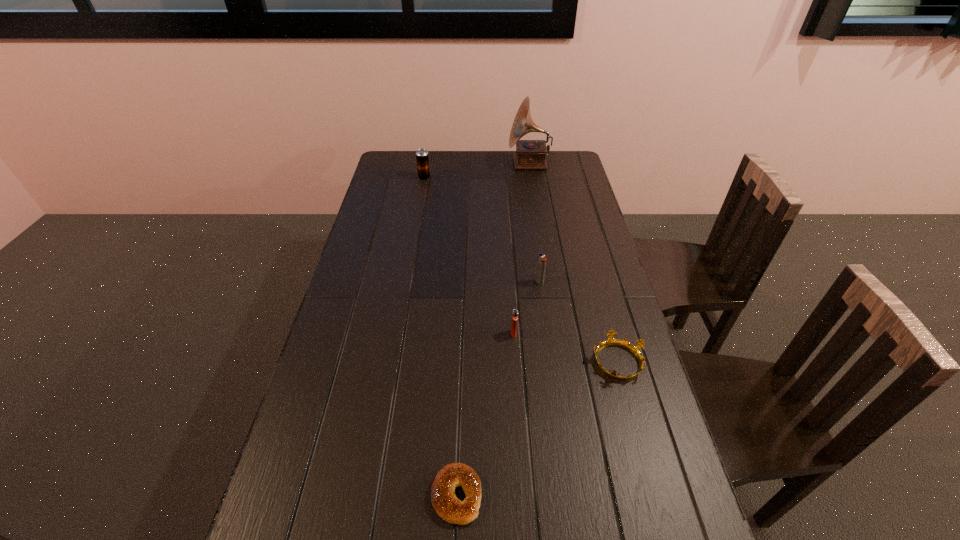
The width and height of the screenshot is (960, 540). What are the coordinates of `vacant point located 0.300m on the horn of the phonograph record` in the screenshot? It's located at (442, 164).

The width and height of the screenshot is (960, 540). I want to click on free spot located on the horn of the phonograph record, so click(x=446, y=164).

The image size is (960, 540). What are the coordinates of `free location located on the horn of the phonograph record` in the screenshot? It's located at (484, 164).

At what (x,y) coordinates should I click in order to perform the action: click on vacant area situated 0.350m on the right of the leftmost object. Please return your answer as a coordinate pair (x, y). The width and height of the screenshot is (960, 540). Looking at the image, I should click on (511, 178).

Find the location of `vacant space located 0.290m on the left of the taller igniter`. vacant space located 0.290m on the left of the taller igniter is located at coordinates (446, 282).

Find the location of a particular element. blank area located on the front of the third shortest object is located at coordinates (519, 414).

This screenshot has height=540, width=960. I want to click on vacant space located 0.360m on the left of the fifth farthest object, so [459, 361].

Locate an element on the screen. vacant space located 0.090m on the back of the shortest object is located at coordinates (459, 429).

Locate an element on the screen. This screenshot has width=960, height=540. phonograph record that is at the far edge is located at coordinates (530, 154).

Locate an element on the screen. beer can present at the far edge is located at coordinates (422, 157).